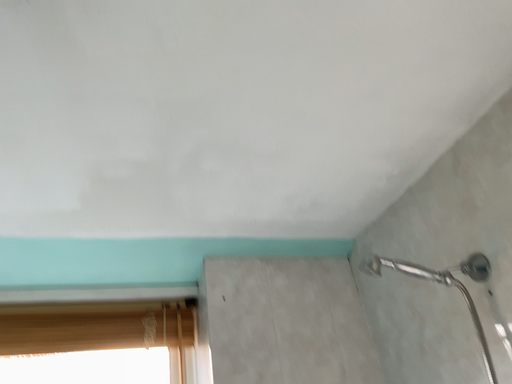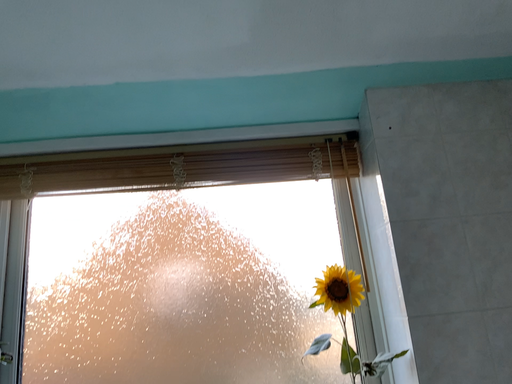
Question: How did the camera likely rotate when shooting the video?

Choices:
 (A) rotated right
 (B) rotated left

Answer: (B)